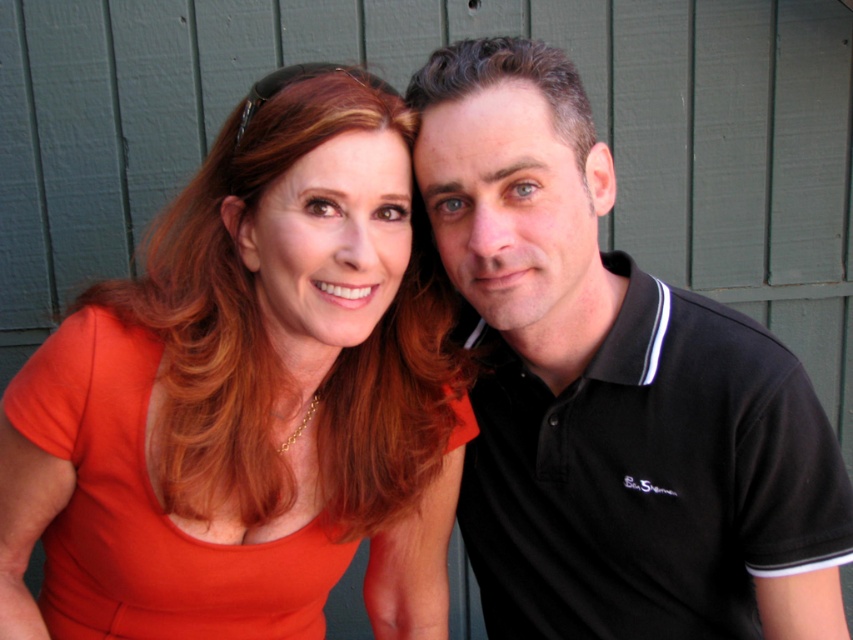
From the picture: Which is more to the right, orange matte dress at center or black cotton polo shirt at right?

Positioned to the right is black cotton polo shirt at right.

Which is below, orange matte dress at center or black cotton polo shirt at right?

orange matte dress at center is lower down.

Does point (178, 419) lie behind point (550, 362)?

That is False.

The width and height of the screenshot is (853, 640). Identify the location of orange matte dress at center. (247, 401).